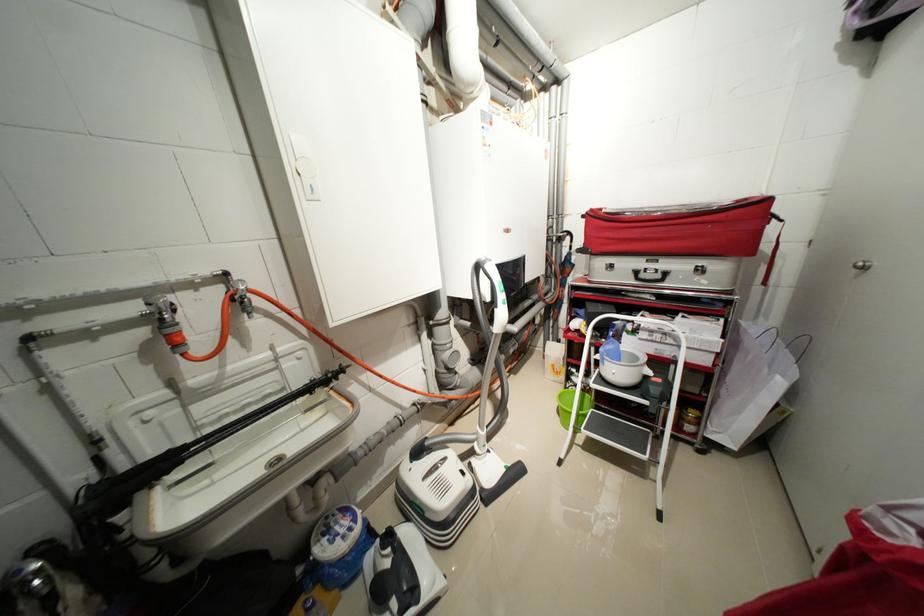
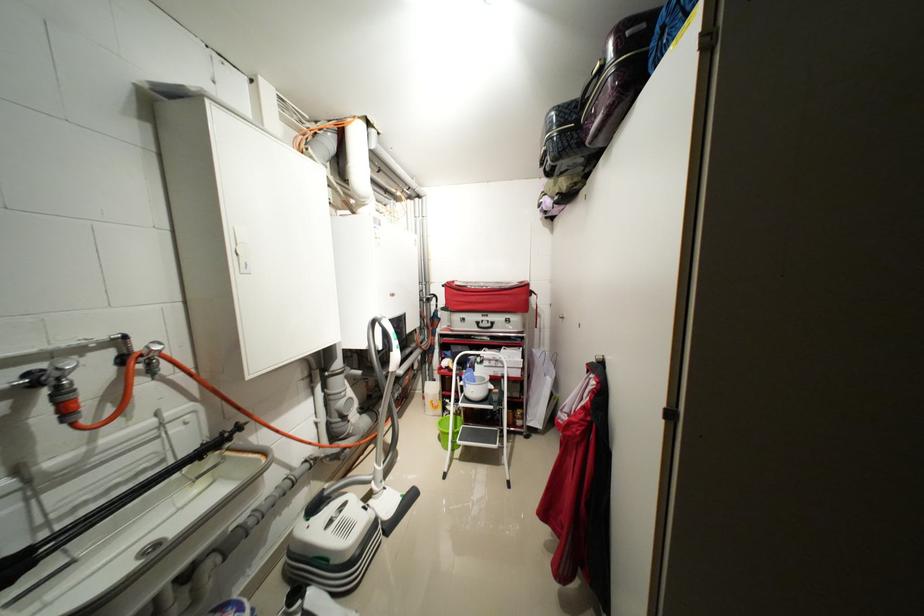
Where in the second image is the point corresponding to the point at 599,211 from the first image?

(455, 284)